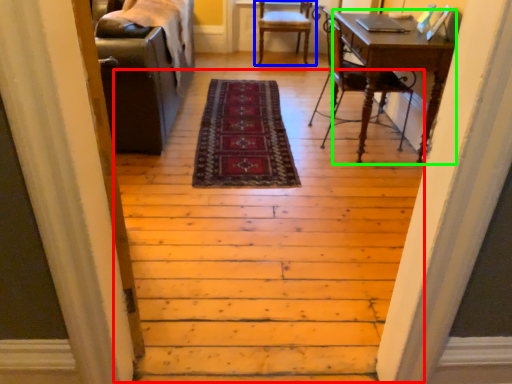
Question: Which object is the farthest from stairwell (highlighted by a red box)? Choose among these: chair (highlighted by a blue box) or computer desk (highlighted by a green box).

Choices:
 (A) chair
 (B) computer desk

Answer: (A)